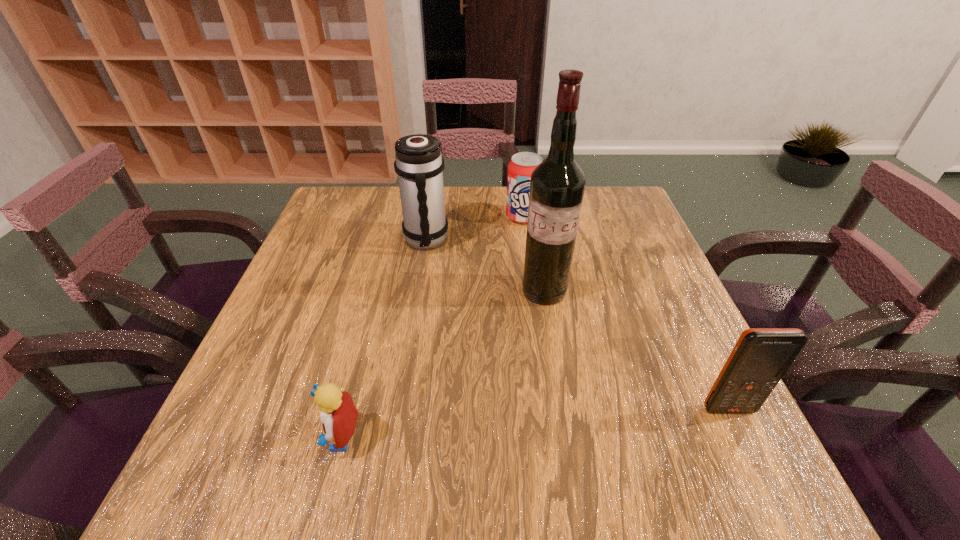
Identify the location of vacant space on the desktop that is between the nearest object and the cellular telephone and is positioned on the surface of the soda can. The height and width of the screenshot is (540, 960). (535, 423).

Where is `free space on the desktop that is between the Lego and the cellular telephone and is positioned on the side with the handle of the fourth shortest object`? The height and width of the screenshot is (540, 960). free space on the desktop that is between the Lego and the cellular telephone and is positioned on the side with the handle of the fourth shortest object is located at coordinates (505, 426).

Where is `vacant spot on the desktop that is between the shortest object and the fourth farthest object and is positioned on the front and back of the third nearest object`? Image resolution: width=960 pixels, height=540 pixels. vacant spot on the desktop that is between the shortest object and the fourth farthest object and is positioned on the front and back of the third nearest object is located at coordinates (511, 425).